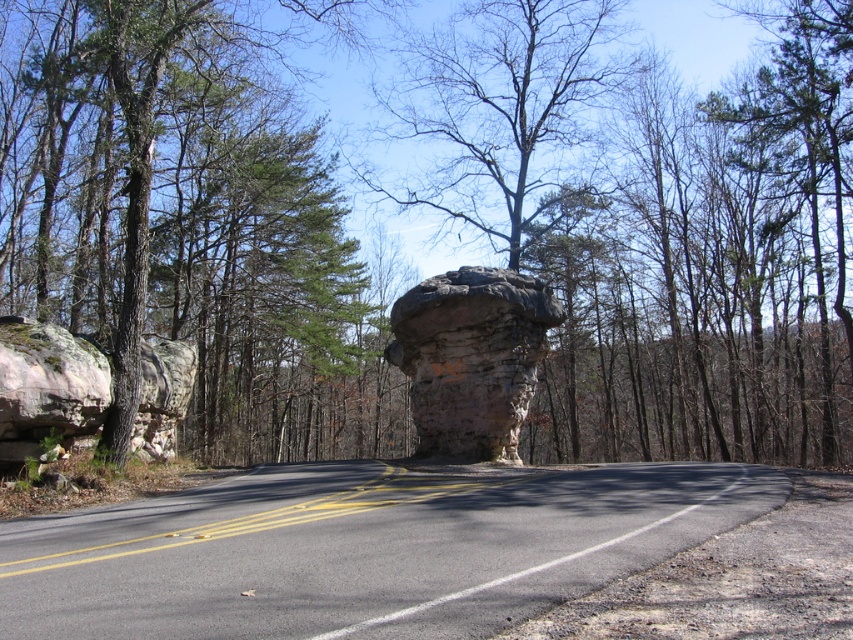
Who is more forward, (x=543, y=236) or (x=265, y=99)?

Point (x=265, y=99)

From the picture: Between green textured tree at center and green mossy rock at center, which one is positioned lower?

Positioned lower is green mossy rock at center.

Where is `green textured tree at center`? The width and height of the screenshot is (853, 640). green textured tree at center is located at coordinates (653, 224).

Where is `green textured tree at center`? green textured tree at center is located at coordinates (653, 224).

Which is above, green mossy rock at center or rustic stone boulder at left?

green mossy rock at center is higher up.

Is green mossy rock at center to the right of rustic stone boulder at left from the viewer's perspective?

In fact, green mossy rock at center is to the left of rustic stone boulder at left.

Does point (194, 189) come behind point (96, 396)?

Yes, point (194, 189) is farther from viewer.

Where is `green mossy rock at center`? green mossy rock at center is located at coordinates (190, 225).

Can you confirm if green mossy rock at center is positioned below rusty stone formation at center?

Actually, green mossy rock at center is above rusty stone formation at center.

Where is `green mossy rock at center`? Image resolution: width=853 pixels, height=640 pixels. green mossy rock at center is located at coordinates (190, 225).

Is point (16, 241) more distant than point (502, 452)?

Yes, point (16, 241) is behind point (502, 452).

Where is `green mossy rock at center`? This screenshot has height=640, width=853. green mossy rock at center is located at coordinates (190, 225).